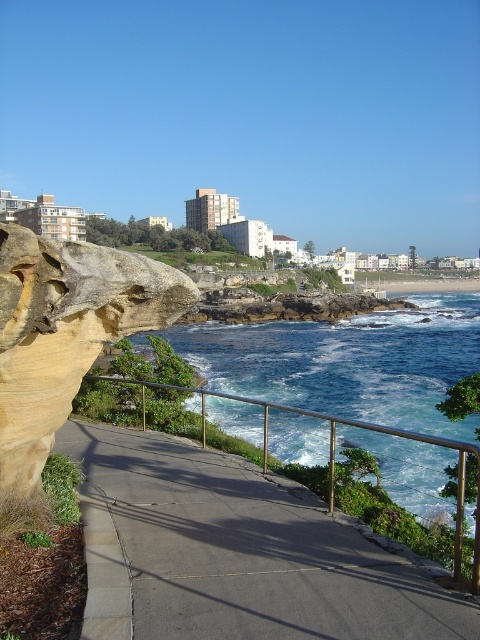
Question: Which of the following is the closest to the observer?

Choices:
 (A) (0, 307)
 (B) (474, 552)

Answer: (A)

Question: Considering the relative positions of yellow sandstone rock at left and metal/rustic rail at center in the image provided, where is yellow sandstone rock at left located with respect to metal/rustic rail at center?

Choices:
 (A) right
 (B) left

Answer: (B)

Question: Which object is closer to the camera taking this photo?

Choices:
 (A) yellow sandstone rock at left
 (B) metal/rustic rail at center

Answer: (A)

Question: Does yellow sandstone rock at left have a larger size compared to metal/rustic rail at center?

Choices:
 (A) yes
 (B) no

Answer: (B)

Question: Does yellow sandstone rock at left come in front of metal/rustic rail at center?

Choices:
 (A) no
 (B) yes

Answer: (B)

Question: Which point is closer to the camera taking this photo?

Choices:
 (A) (27, 380)
 (B) (263, 440)

Answer: (A)